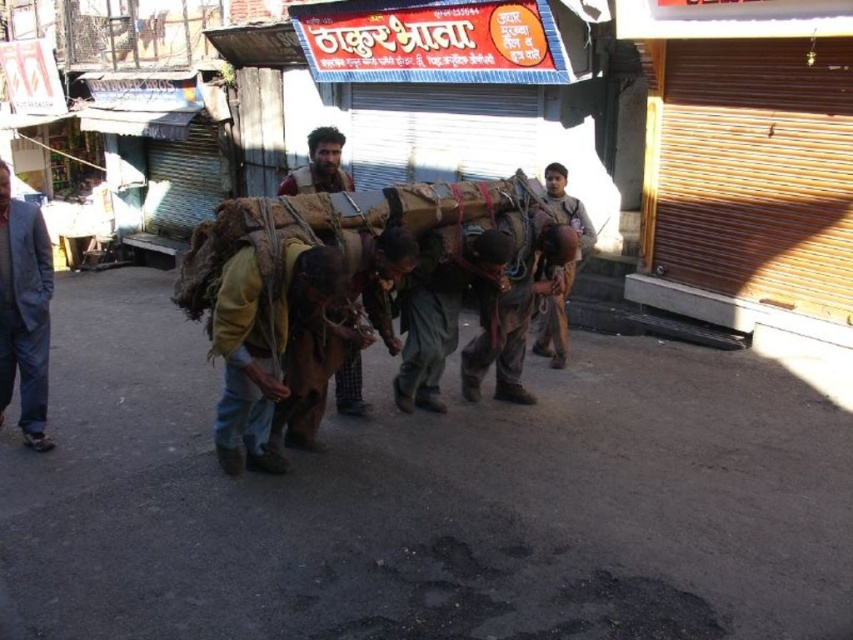
Question: Which of these objects is positioned closest to the light blue fabric jacket at left?

Choices:
 (A) brown leather backpack at center
 (B) brown leather jacket at center
 (C) brown leather bag at center

Answer: (B)

Question: Which of the following is the farthest from the observer?

Choices:
 (A) brown leather backpack at center
 (B) light blue fabric jacket at left

Answer: (A)

Question: Is brown leather jacket at center below brown leather bag at center?

Choices:
 (A) no
 (B) yes

Answer: (B)

Question: Is light blue fabric jacket at left closer to camera compared to brown leather backpack at center?

Choices:
 (A) yes
 (B) no

Answer: (A)

Question: Is light blue fabric jacket at left positioned before brown leather bag at center?

Choices:
 (A) no
 (B) yes

Answer: (B)

Question: Which is nearer to the brown leather jacket at center?

Choices:
 (A) brown leather backpack at center
 (B) light blue fabric jacket at left
 (C) brown leather bag at center

Answer: (A)